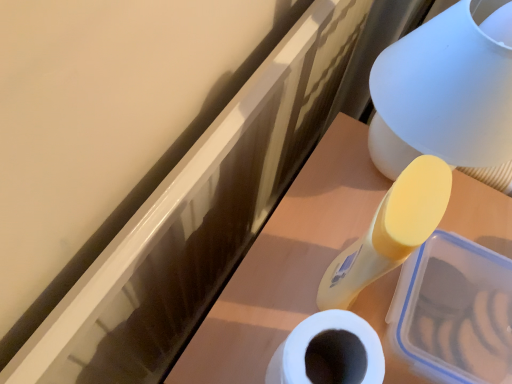
Identify the location of white matte toilet paper at lower center. This screenshot has height=384, width=512. (329, 352).

The image size is (512, 384). I want to click on matte white table lamp at upper right, so click(x=444, y=93).

Where is `white matte toilet paper at lower center`? This screenshot has height=384, width=512. white matte toilet paper at lower center is located at coordinates (329, 352).

Based on the photo, is translucent plastic container at upper right further to camera compared to white matte toilet paper at lower center?

Yes, translucent plastic container at upper right is behind white matte toilet paper at lower center.

From the image's perspective, is translucent plastic container at upper right beneath white matte toilet paper at lower center?

Yes, from the image's perspective, translucent plastic container at upper right is beneath white matte toilet paper at lower center.

Is white matte toilet paper at lower center completely or partially inside translucent plastic container at upper right?

Actually, white matte toilet paper at lower center is outside translucent plastic container at upper right.

Is translucent plastic container at upper right at the right side of white matte toilet paper at lower center?

Indeed, translucent plastic container at upper right is positioned on the right side of white matte toilet paper at lower center.

Who is bigger, matte white table lamp at upper right or white matte toilet paper at lower center?

With larger size is matte white table lamp at upper right.

Is matte white table lamp at upper right further to camera compared to white matte toilet paper at lower center?

No, matte white table lamp at upper right is in front of white matte toilet paper at lower center.

The image size is (512, 384). I want to click on toilet paper lying below the matte white table lamp at upper right (from the image's perspective), so click(329, 352).

Is white matte toilet paper at lower center surrounded by matte white table lamp at upper right?

That's incorrect, white matte toilet paper at lower center is not inside matte white table lamp at upper right.

From a real-world perspective, who is located lower, translucent plastic container at upper right or matte white table lamp at upper right?

translucent plastic container at upper right is physically lower.

Which object is further away from the camera, translucent plastic container at upper right or matte white table lamp at upper right?

translucent plastic container at upper right is behind.

What are the coordinates of `table lamp lying in front of the translucent plastic container at upper right` in the screenshot? It's located at (444, 93).

Between translucent plastic container at upper right and matte white table lamp at upper right, which one has smaller size?

Smaller between the two is matte white table lamp at upper right.

How different are the orientations of white matte toilet paper at lower center and translucent plastic container at upper right in degrees?

0.00369 degrees.

Is translucent plastic container at upper right located within white matte toilet paper at lower center?

Definitely not — translucent plastic container at upper right is not inside white matte toilet paper at lower center.

Which of these two, white matte toilet paper at lower center or translucent plastic container at upper right, is smaller?

Smaller between the two is white matte toilet paper at lower center.

Who is more distant, white matte toilet paper at lower center or translucent plastic container at upper right?

translucent plastic container at upper right is behind.

From a real-world perspective, is matte white table lamp at upper right beneath translucent plastic container at upper right?

No, from a real-world perspective, matte white table lamp at upper right is not beneath translucent plastic container at upper right.

From the image's perspective, relative to translucent plastic container at upper right, is matte white table lamp at upper right above or below?

matte white table lamp at upper right is above translucent plastic container at upper right.

Is matte white table lamp at upper right facing away from translucent plastic container at upper right?

matte white table lamp at upper right does not have its back to translucent plastic container at upper right.

Is point (419, 130) closer or farther from the camera than point (479, 210)?

Clearly, point (419, 130) is closer to the camera than point (479, 210).

Does point (322, 364) appear closer or farther from the camera than point (395, 133)?

Point (322, 364) is positioned closer to the camera compared to point (395, 133).

From the image's perspective, is white matte toilet paper at lower center located above or below matte white table lamp at upper right?

From the image's perspective, white matte toilet paper at lower center appears below matte white table lamp at upper right.

Is white matte toilet paper at lower center oriented away from matte white table lamp at upper right?

No, white matte toilet paper at lower center's orientation is not away from matte white table lamp at upper right.

I want to click on vanity that appears behind the white matte toilet paper at lower center, so click(x=287, y=261).

I want to click on toilet paper below the matte white table lamp at upper right (from a real-world perspective), so click(x=329, y=352).

From the image, which object appears to be nearer to white matte toilet paper at lower center, translucent plastic container at upper right or matte white table lamp at upper right?

translucent plastic container at upper right lies closer to white matte toilet paper at lower center than the other object.

Based on their spatial positions, is white matte toilet paper at lower center or translucent plastic container at upper right closer to matte white table lamp at upper right?

translucent plastic container at upper right.

Estimate the real-world distances between objects in this image. Which object is closer to translucent plastic container at upper right, matte white table lamp at upper right or white matte toilet paper at lower center?

matte white table lamp at upper right is positioned closer to the anchor translucent plastic container at upper right.

From the image, which object appears to be nearer to translucent plastic container at upper right, white matte toilet paper at lower center or matte white table lamp at upper right?

matte white table lamp at upper right lies closer to translucent plastic container at upper right than the other object.

Based on their spatial positions, is translucent plastic container at upper right or white matte toilet paper at lower center closer to matte white table lamp at upper right?

The object closer to matte white table lamp at upper right is translucent plastic container at upper right.

Which object lies further to the anchor point white matte toilet paper at lower center, matte white table lamp at upper right or translucent plastic container at upper right?

matte white table lamp at upper right lies further to white matte toilet paper at lower center than the other object.

Find the location of a particular element. The width and height of the screenshot is (512, 384). toilet paper between matte white table lamp at upper right and translucent plastic container at upper right from top to bottom is located at coordinates (329, 352).